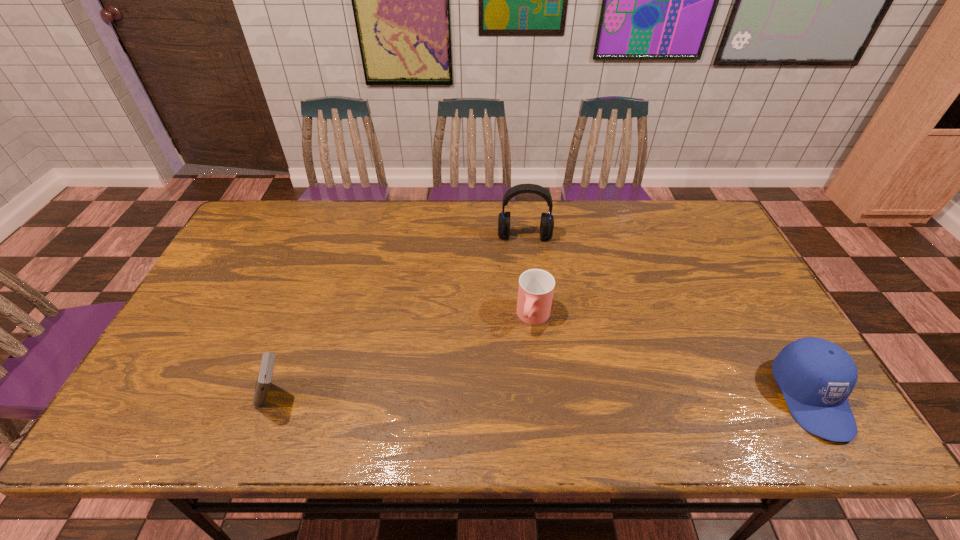
I want to click on free spot located 0.140m on the side of the third nearest object with the handle, so click(513, 377).

This screenshot has width=960, height=540. Identify the location of free location located 0.200m on the side of the third nearest object with the handle. (504, 399).

Locate an element on the screen. The image size is (960, 540). vacant space located on the side of the third nearest object with the handle is located at coordinates (520, 358).

The height and width of the screenshot is (540, 960). I want to click on object present at the far edge, so click(x=547, y=220).

The image size is (960, 540). I want to click on calculator at the near edge, so click(264, 378).

Where is `cap located in the near edge section of the desktop`? The height and width of the screenshot is (540, 960). cap located in the near edge section of the desktop is located at coordinates (816, 376).

Where is `object positioned at the right edge`? object positioned at the right edge is located at coordinates (816, 376).

In order to click on object present at the near right corner in this screenshot , I will do `click(816, 376)`.

At what (x,y) coordinates should I click in order to perform the action: click on blank space at the far edge of the desktop. Please return your answer as a coordinate pair (x, y). Image resolution: width=960 pixels, height=540 pixels. Looking at the image, I should click on (636, 225).

The image size is (960, 540). In the image, there is a desktop. In order to click on vacant space at the near edge in this screenshot , I will do (x=481, y=373).